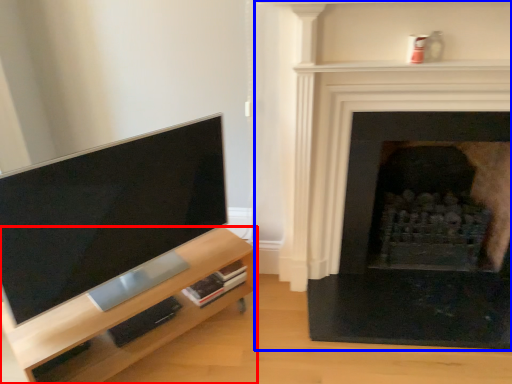
Question: Which object is further to the camera taking this photo, entertainment center (highlighted by a red box) or fireplace (highlighted by a blue box)?

Choices:
 (A) entertainment center
 (B) fireplace

Answer: (B)